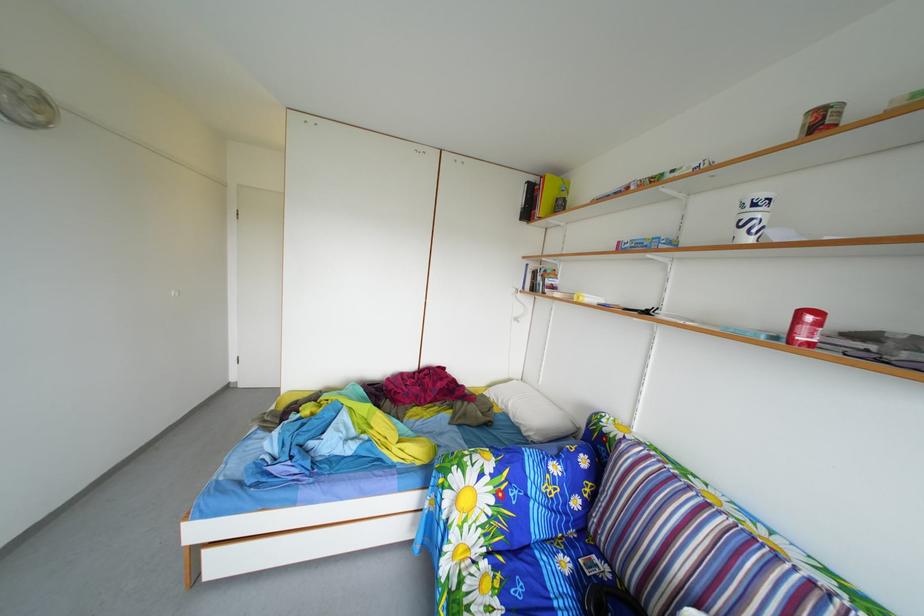
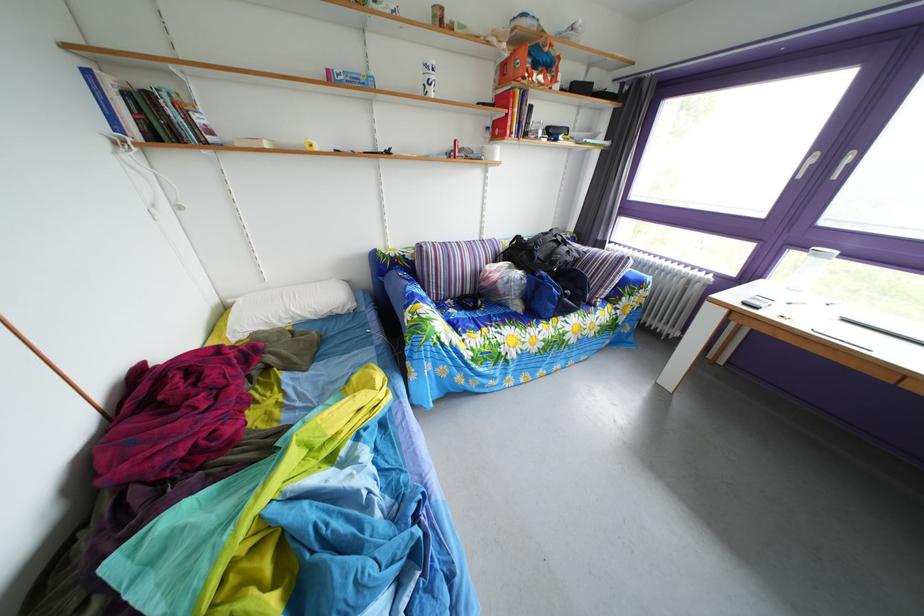
In the second image, find the point that corresponds to pixel 629 252 in the first image.

(339, 79)